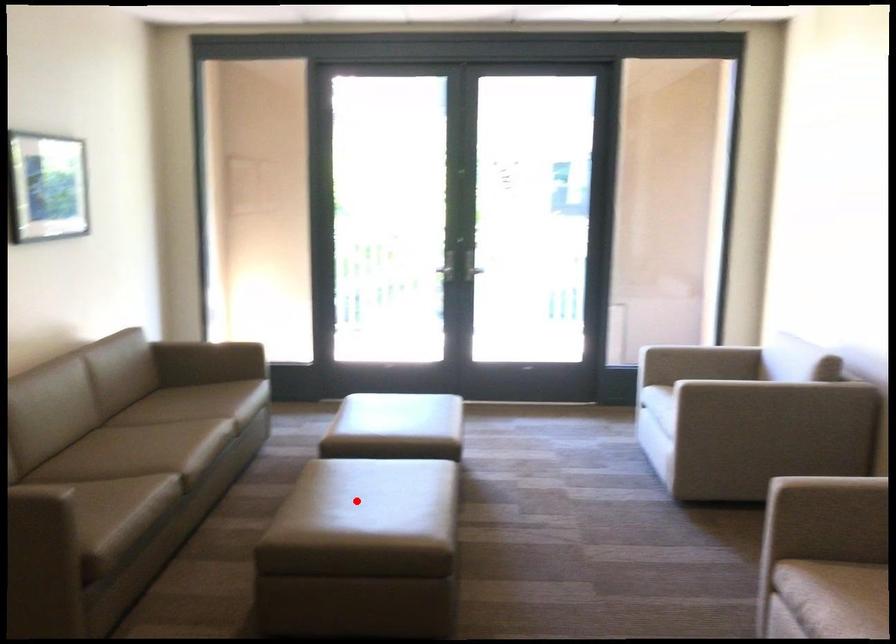
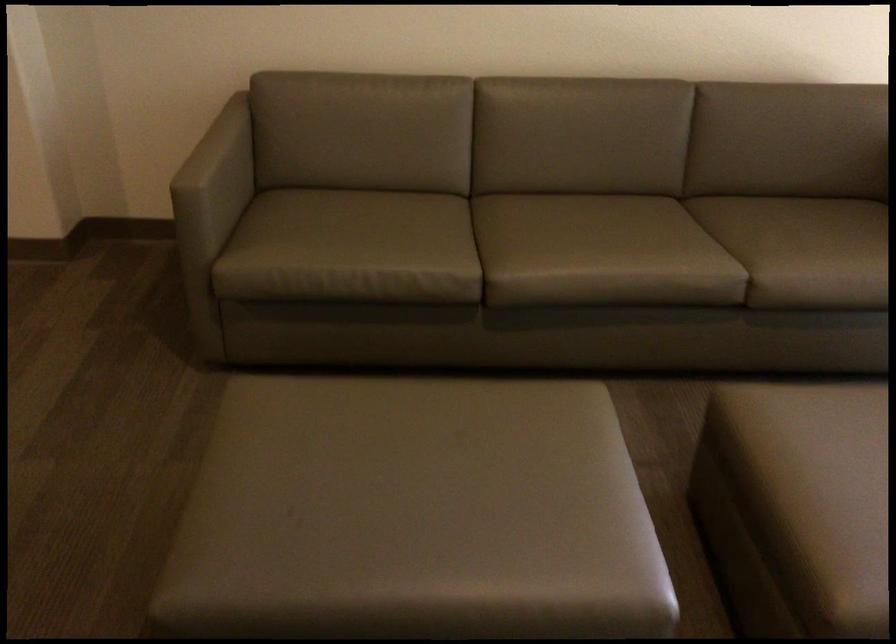
The point at the highlighted location is marked in the first image. Where is the corresponding point in the second image?

(407, 480)